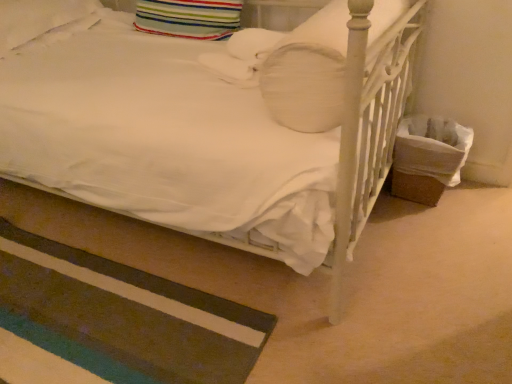
The height and width of the screenshot is (384, 512). Describe the element at coordinates (124, 318) in the screenshot. I see `striped carpet at lower left` at that location.

Where is `striped carpet at lower left`? striped carpet at lower left is located at coordinates (124, 318).

At what (x,y) coordinates should I click in order to perform the action: click on striped fabric pillow at upper center, acting as the second pillow starting from the right. Please return your answer as a coordinate pair (x, y). Looking at the image, I should click on click(x=189, y=18).

Describe the element at coordinates (38, 19) in the screenshot. I see `white soft pillow at upper left, which ranks as the first pillow in left-to-right order` at that location.

Where is `white matte pillow at upper center, placed as the 1th pillow when sorted from right to left`? The width and height of the screenshot is (512, 384). white matte pillow at upper center, placed as the 1th pillow when sorted from right to left is located at coordinates (309, 72).

Who is taller, striped carpet at lower left or white soft pillow at upper left, which ranks as the first pillow in left-to-right order?

Standing taller between the two is white soft pillow at upper left, which ranks as the first pillow in left-to-right order.

From the image's perspective, which is above, striped carpet at lower left or white soft pillow at upper left, which ranks as the first pillow in left-to-right order?

white soft pillow at upper left, which ranks as the first pillow in left-to-right order, appears higher in the image.

Can you confirm if striped carpet at lower left is wider than white soft pillow at upper left, which is counted as the 3th pillow, starting from the right?

Indeed, striped carpet at lower left has a greater width compared to white soft pillow at upper left, which is counted as the 3th pillow, starting from the right.

From a real-world perspective, which object rests below the other?

In real-world perspective, striped carpet at lower left is lower.

In terms of height, does white matte pillow at upper center, placed as the 1th pillow when sorted from right to left, look taller or shorter compared to striped fabric pillow at upper center, acting as the second pillow starting from the right?

Clearly, white matte pillow at upper center, placed as the 1th pillow when sorted from right to left, is taller compared to striped fabric pillow at upper center, acting as the second pillow starting from the right.

Does white matte pillow at upper center, marked as the third pillow in a left-to-right arrangement, turn towards striped fabric pillow at upper center, placed as the second pillow when sorted from left to right?

No, white matte pillow at upper center, marked as the third pillow in a left-to-right arrangement, is not turned towards striped fabric pillow at upper center, placed as the second pillow when sorted from left to right.

Which object is closer to the camera taking this photo, white matte pillow at upper center, marked as the third pillow in a left-to-right arrangement, or striped fabric pillow at upper center, placed as the second pillow when sorted from left to right?

white matte pillow at upper center, marked as the third pillow in a left-to-right arrangement, is more forward.

The height and width of the screenshot is (384, 512). In order to click on pillow above the striped fabric pillow at upper center, placed as the second pillow when sorted from left to right (from a real-world perspective) in this screenshot , I will do `click(309, 72)`.

Does striped carpet at lower left have a lesser height compared to striped fabric pillow at upper center, placed as the second pillow when sorted from left to right?

Correct, striped carpet at lower left is not as tall as striped fabric pillow at upper center, placed as the second pillow when sorted from left to right.

Is striped carpet at lower left aimed at striped fabric pillow at upper center, placed as the second pillow when sorted from left to right?

No, striped carpet at lower left is not turned towards striped fabric pillow at upper center, placed as the second pillow when sorted from left to right.

Consider the image. From a real-world perspective, is striped carpet at lower left above or below striped fabric pillow at upper center, placed as the second pillow when sorted from left to right?

From a real-world perspective, striped carpet at lower left is physically below striped fabric pillow at upper center, placed as the second pillow when sorted from left to right.

Considering the positions of objects striped carpet at lower left and striped fabric pillow at upper center, acting as the second pillow starting from the right, in the image provided, who is more to the left, striped carpet at lower left or striped fabric pillow at upper center, acting as the second pillow starting from the right,?

striped carpet at lower left is more to the left.

From the picture: From the image's perspective, does white soft pillow at upper left, which ranks as the first pillow in left-to-right order, appear lower than striped carpet at lower left?

Incorrect, from the image's perspective, white soft pillow at upper left, which ranks as the first pillow in left-to-right order, is higher than striped carpet at lower left.

Between white soft pillow at upper left, which ranks as the first pillow in left-to-right order, and striped carpet at lower left, which one appears on the left side from the viewer's perspective?

white soft pillow at upper left, which ranks as the first pillow in left-to-right order.

Can you tell me how much white soft pillow at upper left, which is counted as the 3th pillow, starting from the right, and striped carpet at lower left differ in facing direction?

The facing directions of white soft pillow at upper left, which is counted as the 3th pillow, starting from the right, and striped carpet at lower left are 87.4 degrees apart.

From the picture: Which object is further away from the camera, white soft pillow at upper left, which is counted as the 3th pillow, starting from the right, or striped carpet at lower left?

Positioned behind is white soft pillow at upper left, which is counted as the 3th pillow, starting from the right.

Does striped fabric pillow at upper center, placed as the second pillow when sorted from left to right, appear on the right side of striped carpet at lower left?

Yes.

How different are the orientations of striped fabric pillow at upper center, acting as the second pillow starting from the right, and striped carpet at lower left in degrees?

The facing directions of striped fabric pillow at upper center, acting as the second pillow starting from the right, and striped carpet at lower left are 89.9 degrees apart.

Does striped fabric pillow at upper center, acting as the second pillow starting from the right, have a lesser width compared to striped carpet at lower left?

Correct, the width of striped fabric pillow at upper center, acting as the second pillow starting from the right, is less than that of striped carpet at lower left.

Does striped carpet at lower left contain white matte pillow at upper center, marked as the third pillow in a left-to-right arrangement?

Definitely not — white matte pillow at upper center, marked as the third pillow in a left-to-right arrangement, is not inside striped carpet at lower left.

Where is `mat below the white matte pillow at upper center, placed as the 1th pillow when sorted from right to left (from the image's perspective)`? Image resolution: width=512 pixels, height=384 pixels. mat below the white matte pillow at upper center, placed as the 1th pillow when sorted from right to left (from the image's perspective) is located at coordinates [124, 318].

Which object is wider, striped carpet at lower left or white matte pillow at upper center, marked as the third pillow in a left-to-right arrangement?

Wider between the two is striped carpet at lower left.

How far apart are striped carpet at lower left and white matte pillow at upper center, placed as the 1th pillow when sorted from right to left?

A distance of 30.98 inches exists between striped carpet at lower left and white matte pillow at upper center, placed as the 1th pillow when sorted from right to left.

Does point (37, 31) lie behind point (376, 18)?

Yes, point (37, 31) is behind point (376, 18).

Is white soft pillow at upper left, which ranks as the first pillow in left-to-right order, looking in the opposite direction of white matte pillow at upper center, placed as the 1th pillow when sorted from right to left?

No, white soft pillow at upper left, which ranks as the first pillow in left-to-right order, is not facing the opposite direction of white matte pillow at upper center, placed as the 1th pillow when sorted from right to left.

Which is behind, white soft pillow at upper left, which ranks as the first pillow in left-to-right order, or white matte pillow at upper center, marked as the third pillow in a left-to-right arrangement?

Positioned behind is white soft pillow at upper left, which ranks as the first pillow in left-to-right order.

Which object is thinner, white soft pillow at upper left, which ranks as the first pillow in left-to-right order, or white matte pillow at upper center, marked as the third pillow in a left-to-right arrangement?

white soft pillow at upper left, which ranks as the first pillow in left-to-right order.

There is a striped carpet at lower left. At what (x,y) coordinates should I click in order to perform the action: click on the 3rd pillow above it (from the image's perspective). Please return your answer as a coordinate pair (x, y). The width and height of the screenshot is (512, 384). Looking at the image, I should click on (38, 19).

Find the location of `the 1st pillow counting from the left side of the white matte pillow at upper center, marked as the third pillow in a left-to-right arrangement`. the 1st pillow counting from the left side of the white matte pillow at upper center, marked as the third pillow in a left-to-right arrangement is located at coordinates (189, 18).

Which object lies further to the anchor point striped carpet at lower left, striped fabric pillow at upper center, placed as the second pillow when sorted from left to right, or white soft pillow at upper left, which ranks as the first pillow in left-to-right order?

Among the two, white soft pillow at upper left, which ranks as the first pillow in left-to-right order, is located further to striped carpet at lower left.

When comparing their distances from white matte pillow at upper center, placed as the 1th pillow when sorted from right to left, does white soft pillow at upper left, which is counted as the 3th pillow, starting from the right, or striped fabric pillow at upper center, placed as the second pillow when sorted from left to right, seem further?

white soft pillow at upper left, which is counted as the 3th pillow, starting from the right.

Considering their positions, is white matte pillow at upper center, marked as the third pillow in a left-to-right arrangement, positioned closer to striped fabric pillow at upper center, acting as the second pillow starting from the right, than striped carpet at lower left?

white matte pillow at upper center, marked as the third pillow in a left-to-right arrangement, is positioned closer to the anchor striped fabric pillow at upper center, acting as the second pillow starting from the right.

Estimate the real-world distances between objects in this image. Which object is closer to striped carpet at lower left, striped fabric pillow at upper center, placed as the second pillow when sorted from left to right, or white matte pillow at upper center, placed as the 1th pillow when sorted from right to left?

white matte pillow at upper center, placed as the 1th pillow when sorted from right to left.

Based on the photo, looking at the image, which one is located further to white matte pillow at upper center, placed as the 1th pillow when sorted from right to left, striped fabric pillow at upper center, placed as the second pillow when sorted from left to right, or white soft pillow at upper left, which is counted as the 3th pillow, starting from the right?

Among the two, white soft pillow at upper left, which is counted as the 3th pillow, starting from the right, is located further to white matte pillow at upper center, placed as the 1th pillow when sorted from right to left.

From the image, which object appears to be nearer to striped carpet at lower left, white matte pillow at upper center, marked as the third pillow in a left-to-right arrangement, or white soft pillow at upper left, which is counted as the 3th pillow, starting from the right?

The object closer to striped carpet at lower left is white matte pillow at upper center, marked as the third pillow in a left-to-right arrangement.

Estimate the real-world distances between objects in this image. Which object is closer to white matte pillow at upper center, placed as the 1th pillow when sorted from right to left, white soft pillow at upper left, which is counted as the 3th pillow, starting from the right, or striped carpet at lower left?

striped carpet at lower left lies closer to white matte pillow at upper center, placed as the 1th pillow when sorted from right to left, than the other object.

Which object lies further to the anchor point striped fabric pillow at upper center, acting as the second pillow starting from the right, striped carpet at lower left or white soft pillow at upper left, which is counted as the 3th pillow, starting from the right?

striped carpet at lower left is positioned further to the anchor striped fabric pillow at upper center, acting as the second pillow starting from the right.

Find the location of a particular element. pillow between striped fabric pillow at upper center, placed as the second pillow when sorted from left to right, and striped carpet at lower left, in the vertical direction is located at coordinates 309,72.

What are the coordinates of `pillow located between white soft pillow at upper left, which ranks as the first pillow in left-to-right order, and white matte pillow at upper center, placed as the 1th pillow when sorted from right to left, in the left-right direction` in the screenshot? It's located at (189, 18).

Locate an element on the screen. The width and height of the screenshot is (512, 384). mat located between white soft pillow at upper left, which ranks as the first pillow in left-to-right order, and white matte pillow at upper center, placed as the 1th pillow when sorted from right to left, in the left-right direction is located at coordinates (124, 318).